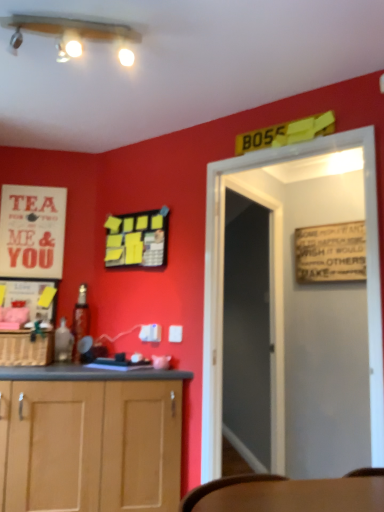
How much space does translucent glass bottle at lower left, which is the second bottle from back to front, occupy vertically?

translucent glass bottle at lower left, which is the second bottle from back to front, is 9.23 inches in height.

What is the approximate width of white paper poster at upper left?

white paper poster at upper left is 2.30 inches in width.

At what (x,y) coordinates should I click in order to perform the action: click on metallic glass bottle at left, acting as the 2th bottle starting from the front. Please return your answer as a coordinate pair (x, y). Image resolution: width=384 pixels, height=512 pixels. Looking at the image, I should click on (80, 320).

You are a GUI agent. You are given a task and a screenshot of the screen. Output one action in this format:
    pyautogui.click(x=<x>, y=<y>)
    Task: Click on the woven brown basket at lower left
    The width and height of the screenshot is (384, 512).
    Given the screenshot: What is the action you would take?
    pyautogui.click(x=26, y=348)

Find the location of `translucent glass bottle at lower left, the first bottle positioned from the front`. translucent glass bottle at lower left, the first bottle positioned from the front is located at coordinates (63, 342).

Based on the photo, between woven brown basket at lower left and white paper poster at upper left, which one has larger width?

woven brown basket at lower left is wider.

Where is `cabinetry directly beneath the white paper poster at upper left (from a real-world perspective)`? This screenshot has height=512, width=384. cabinetry directly beneath the white paper poster at upper left (from a real-world perspective) is located at coordinates (26, 348).

Can you tell me how much woven brown basket at lower left and white paper poster at upper left differ in facing direction?

There is a 0.254-degree angle between the facing directions of woven brown basket at lower left and white paper poster at upper left.

Does woven brown basket at lower left have a larger size compared to white paper poster at upper left?

Yes, woven brown basket at lower left is bigger than white paper poster at upper left.

Considering the points (9, 353) and (80, 306), which point is behind, point (9, 353) or point (80, 306)?

The point (80, 306) is farther from the camera.

Would you say woven brown basket at lower left is outside metallic glass bottle at left, which is the first bottle from back to front?

Yes, woven brown basket at lower left is located beyond the bounds of metallic glass bottle at left, which is the first bottle from back to front.

Considering the relative sizes of woven brown basket at lower left and metallic glass bottle at left, which is the first bottle from back to front, in the image provided, is woven brown basket at lower left shorter than metallic glass bottle at left, which is the first bottle from back to front,?

Yes.

Are woven brown basket at lower left and metallic glass bottle at left, acting as the 2th bottle starting from the front, located far from each other?

No.

Which object is positioned more to the right, metallic glass bottle at left, acting as the 2th bottle starting from the front, or transparent glass door at center?

From the viewer's perspective, transparent glass door at center appears more on the right side.

From the image's perspective, is metallic glass bottle at left, acting as the 2th bottle starting from the front, above or below transparent glass door at center?

From the image's perspective, metallic glass bottle at left, acting as the 2th bottle starting from the front, appears below transparent glass door at center.

Is metallic glass bottle at left, which is the first bottle from back to front, in front of transparent glass door at center?

No.

From the picture: In terms of size, does transparent glass door at center appear bigger or smaller than translucent glass bottle at lower left, which is the second bottle from back to front?

Clearly, transparent glass door at center is larger in size than translucent glass bottle at lower left, which is the second bottle from back to front.

The image size is (384, 512). What are the coordinates of `glass door on the right of translucent glass bottle at lower left, which is the second bottle from back to front` in the screenshot? It's located at (247, 329).

Is transparent glass door at center aimed at translucent glass bottle at lower left, which is the second bottle from back to front?

No, transparent glass door at center is not facing towards translucent glass bottle at lower left, which is the second bottle from back to front.

Considering the relative sizes of transparent glass door at center and translucent glass bottle at lower left, which is the second bottle from back to front, in the image provided, is transparent glass door at center taller than translucent glass bottle at lower left, which is the second bottle from back to front,?

Yes.

Is matte white lights at upper center touching transparent glass door at center?

No, matte white lights at upper center is not in contact with transparent glass door at center.

From the image's perspective, is matte white lights at upper center below transparent glass door at center?

No, from the image's perspective, matte white lights at upper center is not beneath transparent glass door at center.

In the image, is white paper poster at upper left positioned in front of or behind woven brown basket at lower left?

white paper poster at upper left is behind woven brown basket at lower left.

Which of these two, white paper poster at upper left or woven brown basket at lower left, stands shorter?

With less height is woven brown basket at lower left.

From a real-world perspective, is white paper poster at upper left positioned above or below woven brown basket at lower left?

In terms of real-world spatial position, white paper poster at upper left is above woven brown basket at lower left.

Does point (32, 199) lie behind point (46, 342)?

Yes, point (32, 199) is farther from viewer.

Which of these two, woven brown basket at lower left or white wooden door at center, is bigger?

Bigger between the two is white wooden door at center.

Would you consider woven brown basket at lower left to be distant from white wooden door at center?

That's right, there is a large distance between woven brown basket at lower left and white wooden door at center.

Considering the sizes of objects woven brown basket at lower left and white wooden door at center in the image provided, who is taller, woven brown basket at lower left or white wooden door at center?

white wooden door at center is taller.

This screenshot has width=384, height=512. Find the location of `cabinetry that is under the white paper poster at upper left (from a real-world perspective)`. cabinetry that is under the white paper poster at upper left (from a real-world perspective) is located at coordinates [26, 348].

From the woven brown basket at lower left, count 2nd bottles backward and point to it. Please provide its 2D coordinates.

[(80, 320)]

From the picture: From the image, which object appears to be farther from transparent glass door at center, matte white lights at upper center or white wooden door at center?

Among the two, matte white lights at upper center is located further to transparent glass door at center.

Based on their spatial positions, is metallic glass bottle at left, which is the first bottle from back to front, or white wooden door at center closer to white paper poster at upper left?

metallic glass bottle at left, which is the first bottle from back to front, is closer to white paper poster at upper left.

Considering their positions, is translucent glass bottle at lower left, the first bottle positioned from the front, positioned closer to woven brown basket at lower left than metallic glass bottle at left, which is the first bottle from back to front?

Based on the image, translucent glass bottle at lower left, the first bottle positioned from the front, appears to be nearer to woven brown basket at lower left.

Looking at the image, which one is located closer to metallic glass bottle at left, acting as the 2th bottle starting from the front, transparent glass door at center or white paper poster at upper left?

Among the two, white paper poster at upper left is located nearer to metallic glass bottle at left, acting as the 2th bottle starting from the front.

When comparing their distances from metallic glass bottle at left, acting as the 2th bottle starting from the front, does translucent glass bottle at lower left, the first bottle positioned from the front, or woven brown basket at lower left seem further?

woven brown basket at lower left is further to metallic glass bottle at left, acting as the 2th bottle starting from the front.

Estimate the real-world distances between objects in this image. Which object is closer to metallic glass bottle at left, which is the first bottle from back to front, matte white lights at upper center or white paper poster at upper left?

white paper poster at upper left is closer to metallic glass bottle at left, which is the first bottle from back to front.

Which object lies further to the anchor point woven brown basket at lower left, matte white lights at upper center or metallic glass bottle at left, acting as the 2th bottle starting from the front?

matte white lights at upper center lies further to woven brown basket at lower left than the other object.

From the picture: Which object lies further to the anchor point white paper poster at upper left, transparent glass door at center or white wooden door at center?

Among the two, transparent glass door at center is located further to white paper poster at upper left.

You are a GUI agent. You are given a task and a screenshot of the screen. Output one action in this format:
    pyautogui.click(x=<x>, y=<y>)
    Task: Click on the glass door that lies between matte white lights at upper center and woven brown basket at lower left from top to bottom
    
    Given the screenshot: What is the action you would take?
    pyautogui.click(x=247, y=329)

Identify the location of door between matte white lights at upper center and translucent glass bottle at lower left, the first bottle positioned from the front, in the up-down direction. (303, 307).

Image resolution: width=384 pixels, height=512 pixels. Identify the location of glass door between matte white lights at upper center and metallic glass bottle at left, acting as the 2th bottle starting from the front, in the vertical direction. (247, 329).

You are a GUI agent. You are given a task and a screenshot of the screen. Output one action in this format:
    pyautogui.click(x=<x>, y=<y>)
    Task: Click on the door that lies between matte white lights at upper center and transparent glass door at center from top to bottom
    
    Given the screenshot: What is the action you would take?
    pyautogui.click(x=303, y=307)